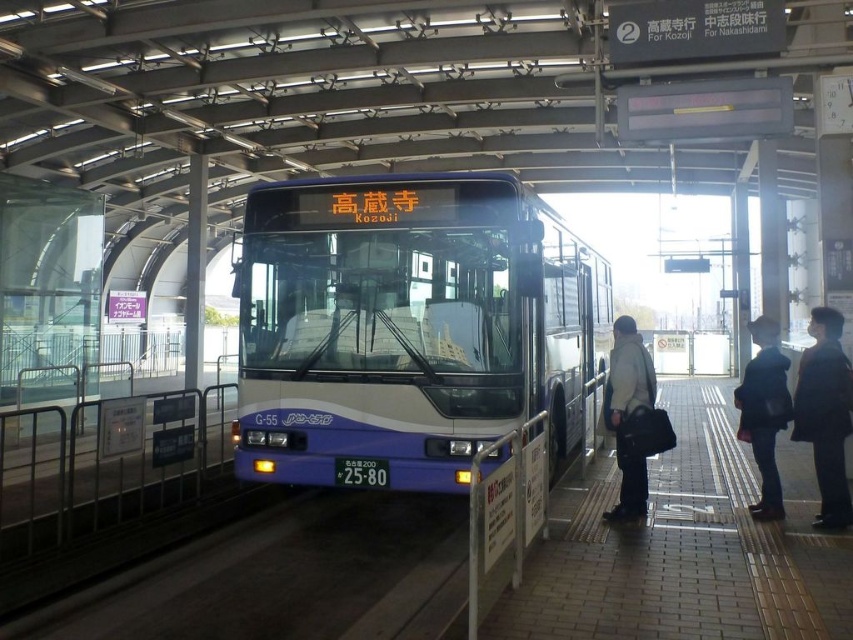
Question: Is blue/white plastic bus at center behind light beige jacket at center?

Choices:
 (A) yes
 (B) no

Answer: (B)

Question: Considering the relative positions of blue/white plastic bus at center and black fabric coat at right in the image provided, where is blue/white plastic bus at center located with respect to black fabric coat at right?

Choices:
 (A) left
 (B) right

Answer: (A)

Question: Among these points, which one is nearest to the camera?

Choices:
 (A) (848, 412)
 (B) (614, 420)
 (C) (763, 458)

Answer: (A)

Question: Which of the following is the farthest from the observer?

Choices:
 (A) black fabric coat at right
 (B) light beige jacket at center

Answer: (B)

Question: Which object is positioned closest to the black fabric coat at right?

Choices:
 (A) dark blue jacket at right
 (B) light beige jacket at center
 (C) blue/white plastic bus at center

Answer: (A)

Question: Does black fabric coat at right have a lesser width compared to dark blue jacket at right?

Choices:
 (A) no
 (B) yes

Answer: (A)